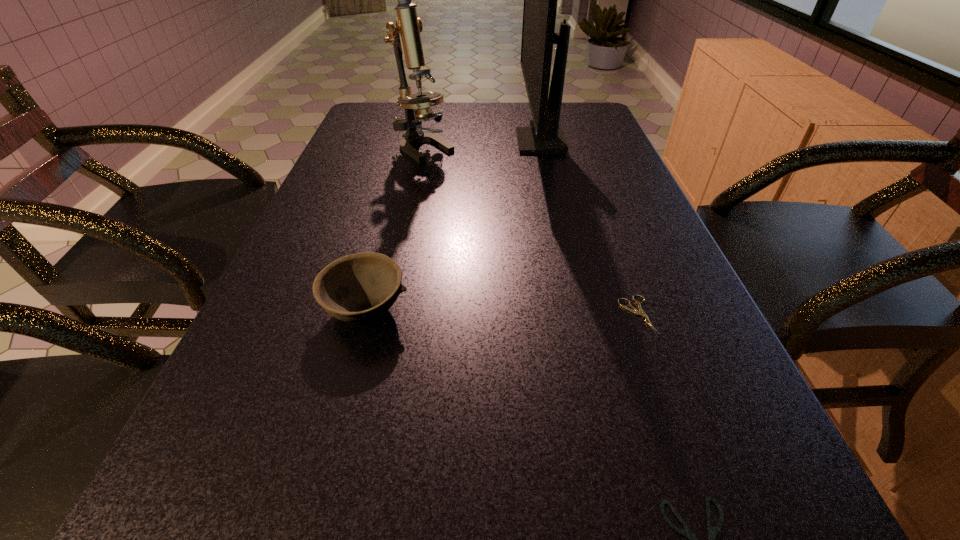
The height and width of the screenshot is (540, 960). In the image, there is a desktop. Identify the location of vacant space at the far right corner. pos(590,121).

Where is `vacant region between the computer monitor and the fourth tallest object`? This screenshot has width=960, height=540. vacant region between the computer monitor and the fourth tallest object is located at coordinates (588, 228).

Locate an element on the screen. The image size is (960, 540). free space between the bowl and the taller shears is located at coordinates (501, 313).

Find the location of a particular element. Image resolution: width=960 pixels, height=540 pixels. vacant space that's between the fourth tallest object and the microscope is located at coordinates (531, 232).

This screenshot has height=540, width=960. I want to click on free space between the microscope and the computer monitor, so click(483, 145).

At what (x,y) coordinates should I click in order to perform the action: click on free space between the computer monitor and the fourth tallest object. Please return your answer as a coordinate pair (x, y). The width and height of the screenshot is (960, 540). Looking at the image, I should click on (588, 228).

The image size is (960, 540). I want to click on vacant region between the taller shears and the computer monitor, so click(x=588, y=228).

Point out which object is positioned as the nearest to the microscope. Please provide its 2D coordinates. Your answer should be formatted as a tuple, i.e. [(x, y)], where the tuple contains the x and y coordinates of a point satisfying the conditions above.

[(546, 136)]

Locate an element on the screen. This screenshot has height=540, width=960. object that stands as the closest to the computer monitor is located at coordinates (405, 37).

This screenshot has width=960, height=540. Find the location of `vacant space that satisfies the following two spatial constraints: 1. on the front side of the microscope; 2. on the left side of the taller shears`. vacant space that satisfies the following two spatial constraints: 1. on the front side of the microscope; 2. on the left side of the taller shears is located at coordinates (391, 315).